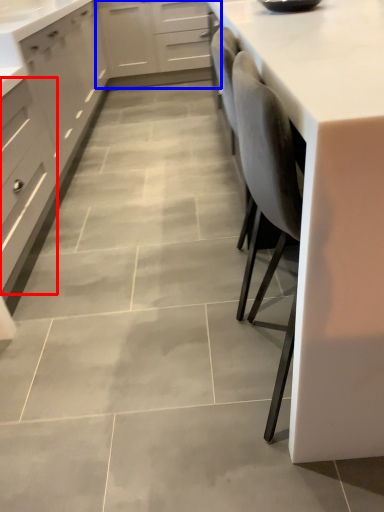
Question: Which object appears farthest to the camera in this image, drawer (highlighted by a red box) or cabinetry (highlighted by a blue box)?

Choices:
 (A) drawer
 (B) cabinetry

Answer: (B)